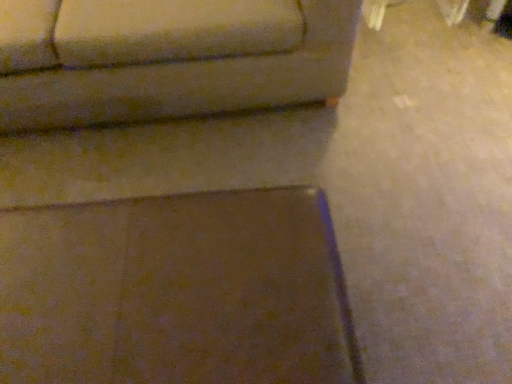
Identify the location of beige fabric couch at upper left. The image size is (512, 384). (167, 58).

What do you see at coordinates (167, 58) in the screenshot? I see `beige fabric couch at upper left` at bounding box center [167, 58].

At what (x,y) coordinates should I click in order to perform the action: click on beige fabric couch at upper left. Please return your answer as a coordinate pair (x, y). Looking at the image, I should click on (167, 58).